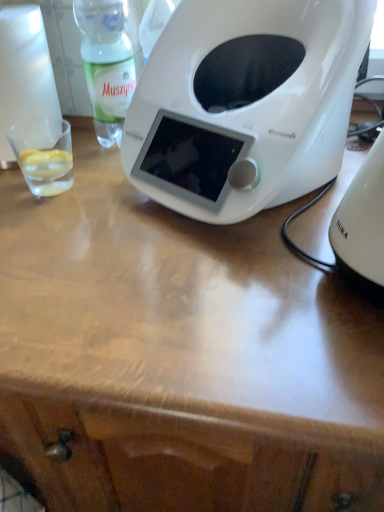
Locate an element on the screen. The height and width of the screenshot is (512, 384). vacant space in between white paper towel at left and green translucent bottle at upper left is located at coordinates (88, 146).